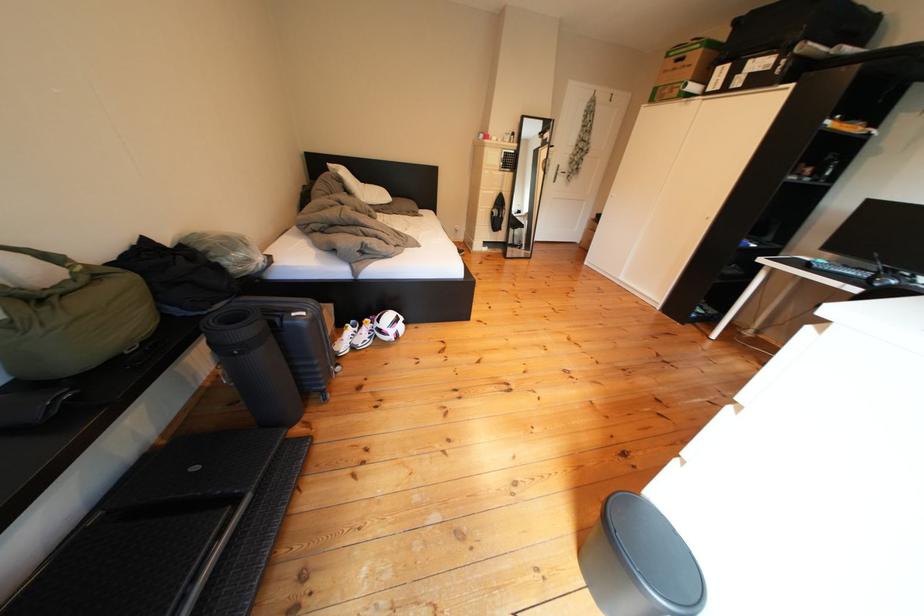
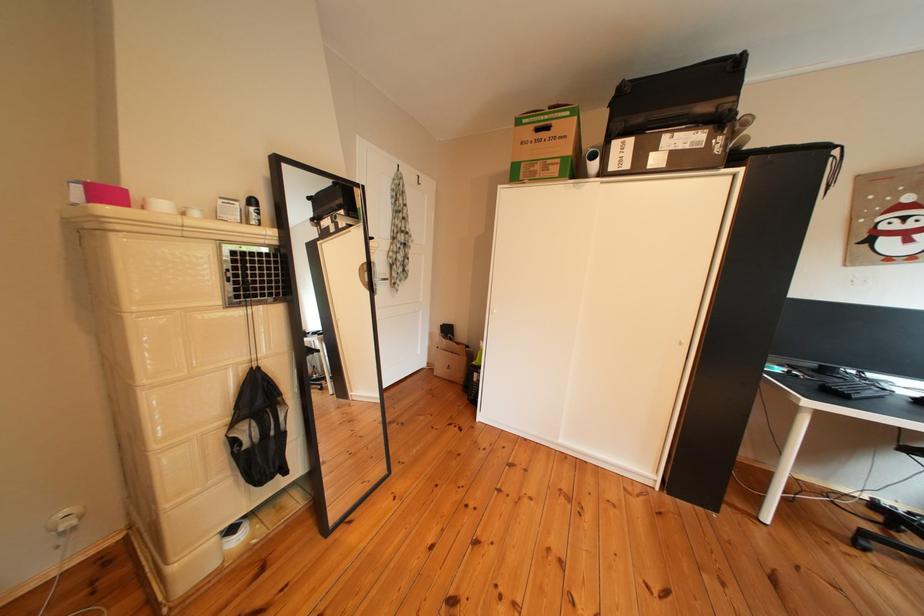
The point at (506, 217) is marked in the first image. Where is the corresponding point in the second image?

(249, 447)